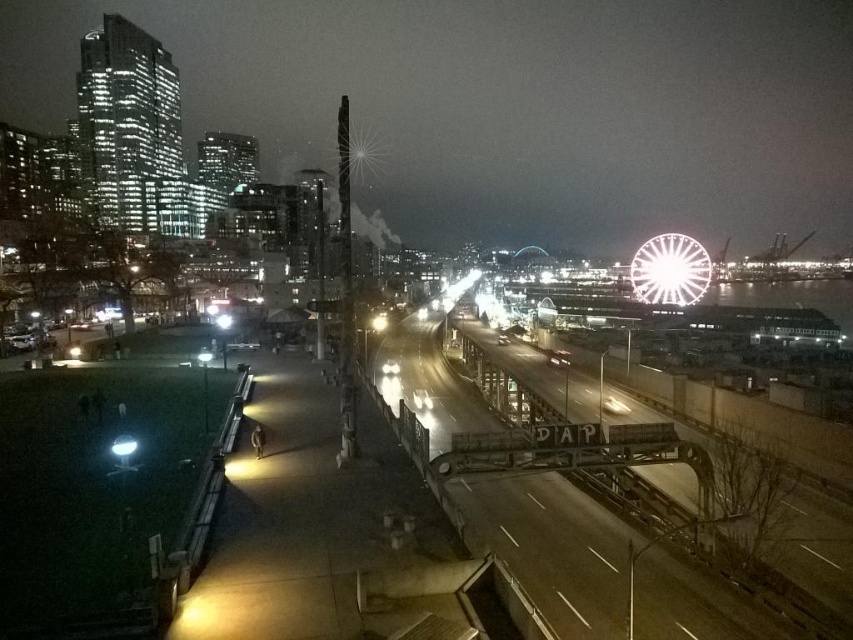
Question: Which object appears farthest from the camera in this image?

Choices:
 (A) metallic gray train track at center
 (B) white metallic ferris wheel at right

Answer: (B)

Question: Can you confirm if metallic gray train track at center is bigger than white metallic ferris wheel at right?

Choices:
 (A) no
 (B) yes

Answer: (B)

Question: Is metallic gray train track at center further to the viewer compared to white metallic ferris wheel at right?

Choices:
 (A) no
 (B) yes

Answer: (A)

Question: Which object is closer to the camera taking this photo?

Choices:
 (A) white metallic ferris wheel at right
 (B) metallic gray train track at center

Answer: (B)

Question: Which point is closer to the camera taking this photo?

Choices:
 (A) (700, 276)
 (B) (732, 637)

Answer: (B)

Question: Is metallic gray train track at center below white metallic ferris wheel at right?

Choices:
 (A) yes
 (B) no

Answer: (A)